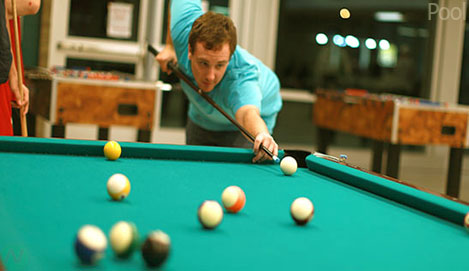
Locate an element on the screen. foosball tables is located at coordinates (416, 113), (103, 109).